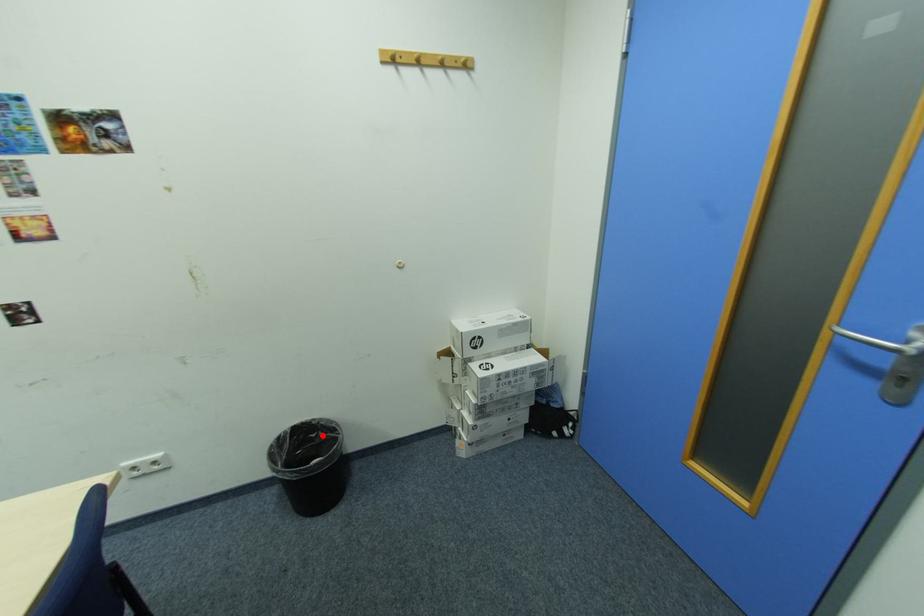
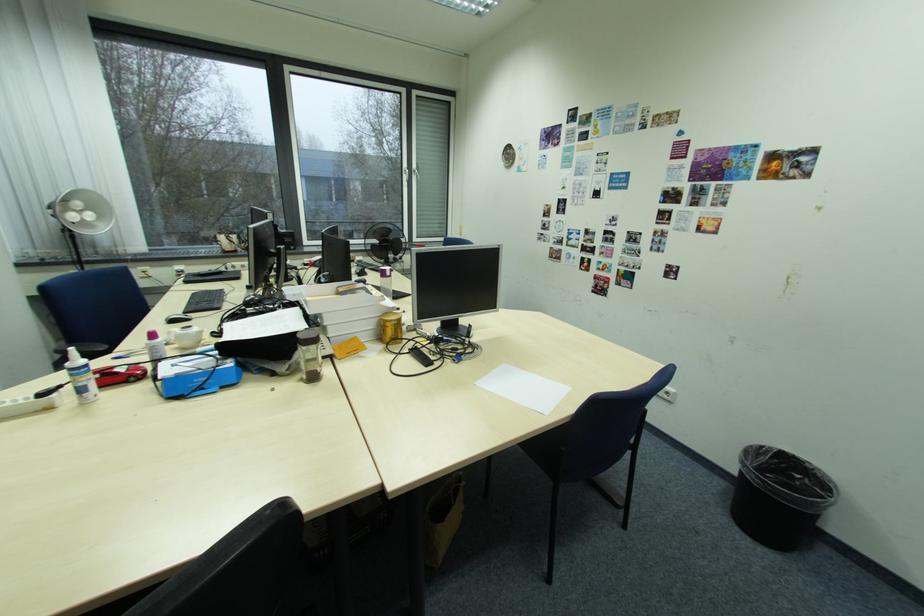
Where in the second image is the point corresponding to the highlighted location from the first image?

(807, 477)